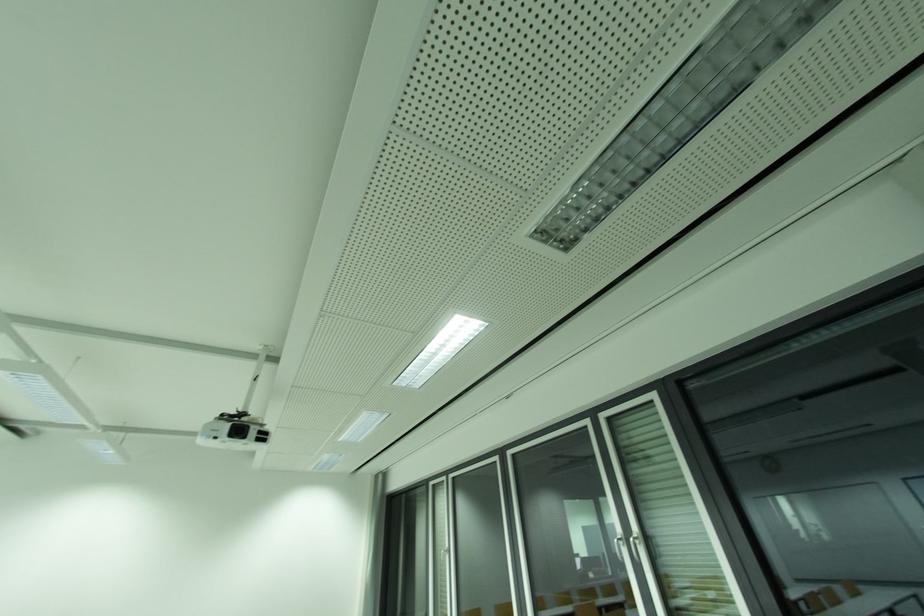
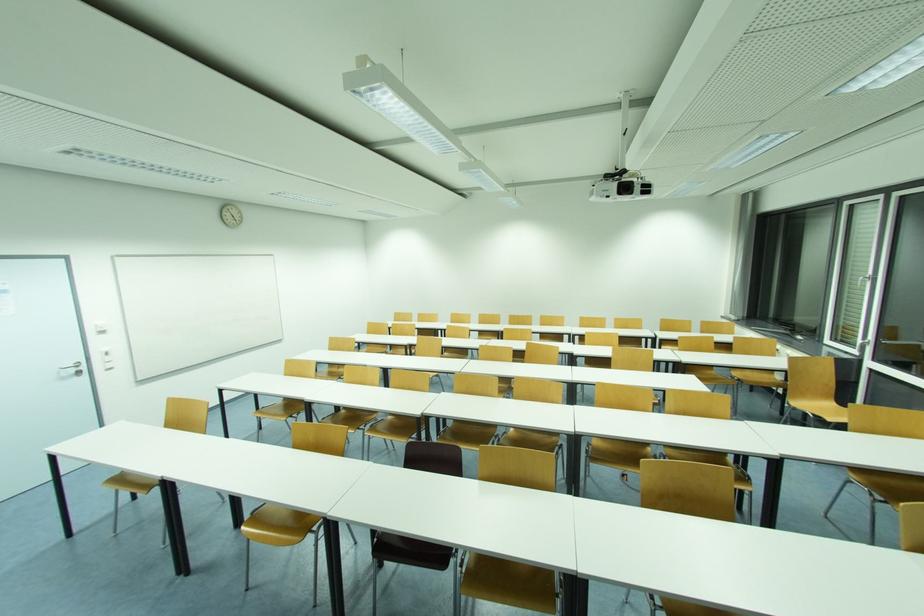
The first image is from the beginning of the video and the second image is from the end. How did the camera likely rotate when shooting the video?

The camera rotated toward left-down.